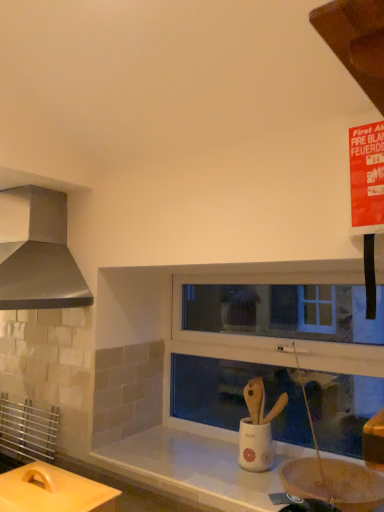
The width and height of the screenshot is (384, 512). Find the location of `matte yellow cutting board at lower left`. matte yellow cutting board at lower left is located at coordinates (53, 490).

Image resolution: width=384 pixels, height=512 pixels. What do you see at coordinates (279, 358) in the screenshot? I see `white plastic window frame at center` at bounding box center [279, 358].

What do you see at coordinates (37, 252) in the screenshot? I see `metallic stainless steel range hood at left` at bounding box center [37, 252].

Identify the location of metallic stainless steel range hood at left. (37, 252).

At what (x,y) coordinates should I click in order to perform the action: click on white ceramic sink at center. Please return your answer as a coordinate pair (x, y). This screenshot has width=384, height=512. Looking at the image, I should click on (257, 428).

Where is `matte yellow cutting board at lower left`? matte yellow cutting board at lower left is located at coordinates (53, 490).

Can you confirm if white plastic window frame at center is positioned to the right of white ceramic sink at center?

Correct, you'll find white plastic window frame at center to the right of white ceramic sink at center.

Locate an element on the screen. Image resolution: width=384 pixels, height=512 pixels. sink located underneath the white plastic window frame at center (from a real-world perspective) is located at coordinates click(257, 428).

Would you say white plastic window frame at center is outside white ceramic sink at center?

Yes, white plastic window frame at center is located beyond the bounds of white ceramic sink at center.

How many degrees apart are the facing directions of white plastic window frame at center and white ceramic sink at center?

0.377 degrees separate the facing orientations of white plastic window frame at center and white ceramic sink at center.

Does white ceramic sink at center contain matte yellow cutting board at lower left?

Definitely not — matte yellow cutting board at lower left is not inside white ceramic sink at center.

In the scene shown: Between white ceramic sink at center and matte yellow cutting board at lower left, which one has less height?

Standing shorter between the two is matte yellow cutting board at lower left.

Locate an element on the screen. The image size is (384, 512). table located in front of the white ceramic sink at center is located at coordinates pos(53,490).

Consider the image. Considering their positions, is white ceramic sink at center located in front of or behind matte yellow cutting board at lower left?

In the image, white ceramic sink at center appears behind matte yellow cutting board at lower left.

Are metallic stainless steel range hood at left and white plastic window frame at center far apart?

They are positioned close to each other.

From a real-world perspective, is metallic stainless steel range hood at left below white plastic window frame at center?

Incorrect, from a real-world perspective, metallic stainless steel range hood at left is higher than white plastic window frame at center.

Considering the sizes of metallic stainless steel range hood at left and white plastic window frame at center in the image, is metallic stainless steel range hood at left bigger or smaller than white plastic window frame at center?

Clearly, metallic stainless steel range hood at left is larger in size than white plastic window frame at center.

How different are the orientations of metallic stainless steel range hood at left and white plastic window frame at center in degrees?

0.724 degrees separate the facing orientations of metallic stainless steel range hood at left and white plastic window frame at center.

Is matte yellow cutting board at lower left outside of metallic stainless steel range hood at left?

A: Yes, matte yellow cutting board at lower left is outside of metallic stainless steel range hood at left.

Is matte yellow cutting board at lower left positioned with its back to metallic stainless steel range hood at left?

No.

Which of these two, matte yellow cutting board at lower left or metallic stainless steel range hood at left, is bigger?

metallic stainless steel range hood at left is bigger.

Is matte yellow cutting board at lower left positioned before metallic stainless steel range hood at left?

Yes, the depth of matte yellow cutting board at lower left is less than that of metallic stainless steel range hood at left.

Is matte yellow cutting board at lower left oriented away from white plastic window frame at center?

Yes, matte yellow cutting board at lower left is positioned with its back facing white plastic window frame at center.

Considering the positions of objects matte yellow cutting board at lower left and white plastic window frame at center in the image provided, who is behind, matte yellow cutting board at lower left or white plastic window frame at center?

white plastic window frame at center is further from the camera.

From a real-world perspective, is matte yellow cutting board at lower left over white plastic window frame at center?

No, from a real-world perspective, matte yellow cutting board at lower left is not over white plastic window frame at center

Between matte yellow cutting board at lower left and white plastic window frame at center, which one has larger width?

matte yellow cutting board at lower left.

Is matte yellow cutting board at lower left aimed at white ceramic sink at center?

No, matte yellow cutting board at lower left is not turned towards white ceramic sink at center.

Is point (94, 492) positioned behind point (255, 454)?

No, it is in front of (255, 454).

Based on the photo, considering the positions of objects matte yellow cutting board at lower left and white ceramic sink at center in the image provided, who is more to the left, matte yellow cutting board at lower left or white ceramic sink at center?

Positioned to the left is matte yellow cutting board at lower left.

Considering the sizes of white ceramic sink at center and white plastic window frame at center in the image, is white ceramic sink at center bigger or smaller than white plastic window frame at center?

In the image, white ceramic sink at center appears to be smaller than white plastic window frame at center.

In order to click on sink lying behind the white plastic window frame at center in this screenshot , I will do `click(257, 428)`.

Is white ceramic sink at center oriented towards white plastic window frame at center?

No, white ceramic sink at center is not turned towards white plastic window frame at center.

Considering the relative positions of white ceramic sink at center and white plastic window frame at center in the image provided, is white ceramic sink at center in front of white plastic window frame at center?

No, it is not.

Locate an element on the screen. The width and height of the screenshot is (384, 512). sink lying behind the white plastic window frame at center is located at coordinates (257, 428).

At what (x,y) coordinates should I click in order to perform the action: click on table lying in front of the white ceramic sink at center. Please return your answer as a coordinate pair (x, y). The height and width of the screenshot is (512, 384). Looking at the image, I should click on (53, 490).

Estimate the real-world distances between objects in this image. Which object is closer to white ceramic sink at center, metallic stainless steel range hood at left or matte yellow cutting board at lower left?

matte yellow cutting board at lower left is positioned closer to the anchor white ceramic sink at center.

Based on their spatial positions, is white ceramic sink at center or white plastic window frame at center closer to metallic stainless steel range hood at left?

white plastic window frame at center is positioned closer to the anchor metallic stainless steel range hood at left.

Based on their spatial positions, is metallic stainless steel range hood at left or white plastic window frame at center further from matte yellow cutting board at lower left?

The object further to matte yellow cutting board at lower left is white plastic window frame at center.

Estimate the real-world distances between objects in this image. Which object is closer to matte yellow cutting board at lower left, white ceramic sink at center or white plastic window frame at center?

Among the two, white ceramic sink at center is located nearer to matte yellow cutting board at lower left.

From the image, which object appears to be nearer to white plastic window frame at center, metallic stainless steel range hood at left or white ceramic sink at center?

Among the two, white ceramic sink at center is located nearer to white plastic window frame at center.

Looking at the image, which one is located closer to white plastic window frame at center, metallic stainless steel range hood at left or matte yellow cutting board at lower left?

metallic stainless steel range hood at left lies closer to white plastic window frame at center than the other object.

Based on their spatial positions, is matte yellow cutting board at lower left or white ceramic sink at center further from white plastic window frame at center?

matte yellow cutting board at lower left is positioned further to the anchor white plastic window frame at center.

Considering their positions, is matte yellow cutting board at lower left positioned further to white ceramic sink at center than white plastic window frame at center?

matte yellow cutting board at lower left is further to white ceramic sink at center.

Where is `sink located between matte yellow cutting board at lower left and white plastic window frame at center in the left-right direction`? sink located between matte yellow cutting board at lower left and white plastic window frame at center in the left-right direction is located at coordinates (257, 428).

Find the location of a particular element. Image resolution: width=384 pixels, height=512 pixels. table between metallic stainless steel range hood at left and white plastic window frame at center from left to right is located at coordinates (53, 490).

The image size is (384, 512). In order to click on table situated between metallic stainless steel range hood at left and white ceramic sink at center from left to right in this screenshot , I will do `click(53, 490)`.

Find the location of a particular element. sink located between metallic stainless steel range hood at left and white plastic window frame at center in the left-right direction is located at coordinates (257, 428).